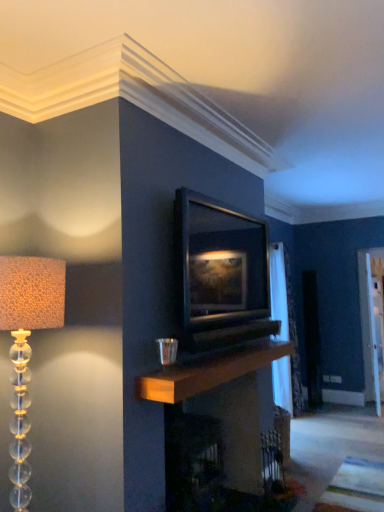
Question: Based on their sizes in the image, would you say translucent glass lampshade at left is bigger or smaller than matte black picture frame at center?

Choices:
 (A) small
 (B) big

Answer: (B)

Question: Do you think translucent glass lampshade at left is within matte black picture frame at center, or outside of it?

Choices:
 (A) inside
 (B) outside

Answer: (B)

Question: Based on their relative distances, which object is nearer to the wooden mantle at center?

Choices:
 (A) white sheer curtain at right
 (B) translucent glass lampshade at left
 (C) transparent glass door at right
 (D) matte black picture frame at center

Answer: (D)

Question: Estimate the real-world distances between objects in this image. Which object is farther from the white sheer curtain at right?

Choices:
 (A) matte black picture frame at center
 (B) transparent glass door at right
 (C) translucent glass lampshade at left
 (D) wooden mantle at center

Answer: (C)